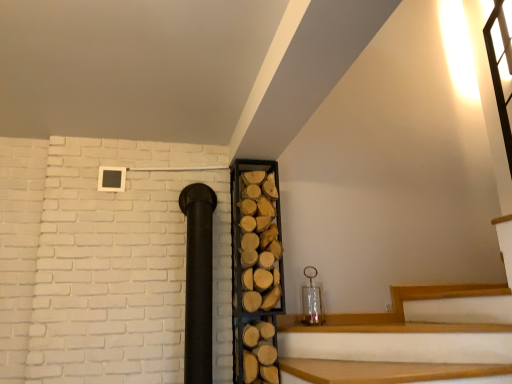
Describe the element at coordinates (256, 269) in the screenshot. Image resolution: width=512 pixels, height=384 pixels. I see `wooden logs at center` at that location.

What is the approximate height of wooden logs at center?

wooden logs at center is 4.66 feet tall.

You are a GUI agent. You are given a task and a screenshot of the screen. Output one action in this format:
    pyautogui.click(x=<x>, y=<y>)
    Task: Click on the wooden logs at center
    The image size is (512, 384).
    Given the screenshot: What is the action you would take?
    pyautogui.click(x=256, y=269)

What are the coordinates of `wooden logs at center` in the screenshot? It's located at (256, 269).